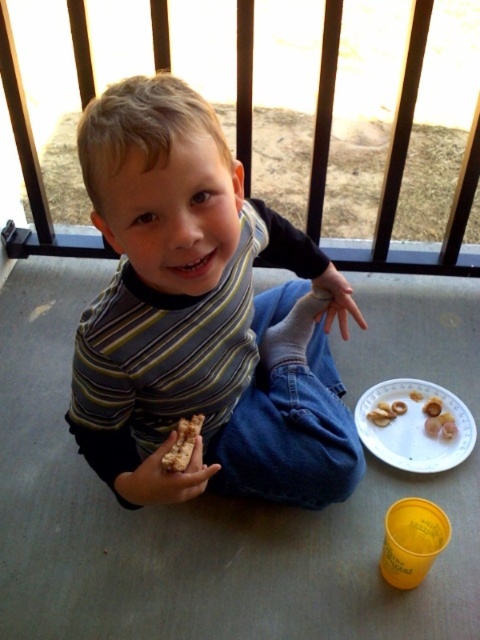
You are a parent who wants to place a small toy between the white paper plate at lower right and the white matte crackers at lower right. Can you fit the toy there?

The distance between the white paper plate at lower right and the white matte crackers at lower right is 1.28 inches, so if the toy is smaller than 1.28 inches in width, it can fit between them.

The child has two snacks in front of them. Which snack is taller, the white matte crackers at lower right or the brown crumbly snack at lower left?

The white matte crackers at lower right has a greater height compared to the brown crumbly snack at lower left, so the white matte crackers at lower right is taller.